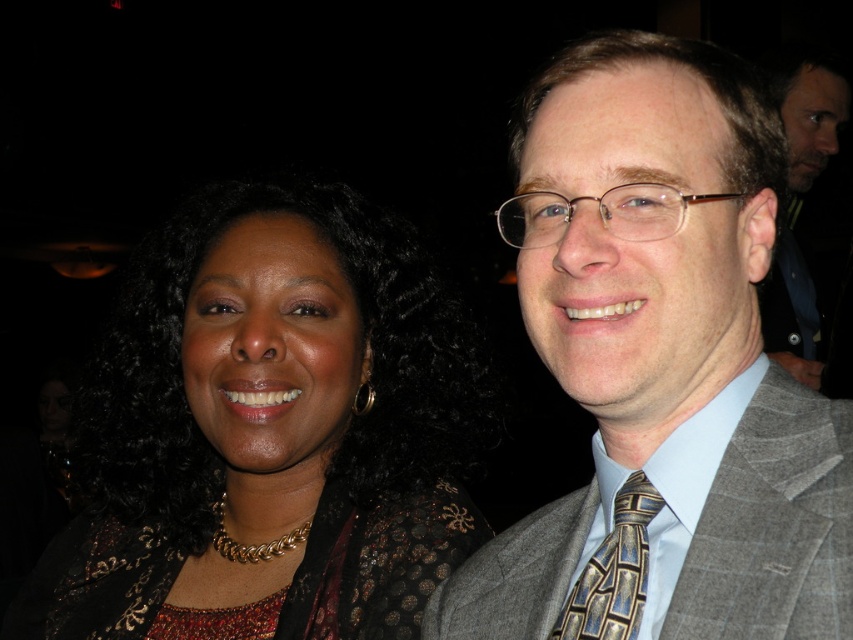
You are a photographer setting up for a group photo. You have two subjects wearing the gray textured suit at center and the gold beaded necklace at center. To ensure both are visible in the frame, which clothing item should you focus on first?

The gray textured suit at center has a lesser height compared to the gold beaded necklace at center, so you should focus on the gold beaded necklace at center first to ensure it is in frame.

You are standing at the camera position taking a photo of two people. You want to adjust your position to be exactly 1 meter away from the point at coordinates point (233,525). Is your current position already within the desired distance?

The distance between point (233,525) and the camera is 1.01 meters, which is slightly more than 1 meter. Therefore, you need to move closer by approximately 1 centimeter to achieve the desired distance.